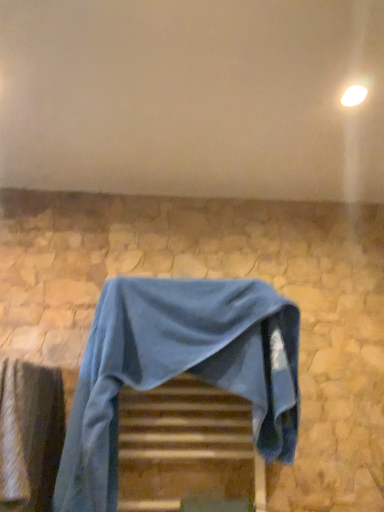
What is the approximate height of blue fabric at lower left?

It is 16.60 inches.

Looking at this image, in order to face wooden at center, should I rotate leftwards or rightwards?

Rotate your view left by about 0.312°.

Measure the distance between blue fabric-covered chair at center and camera.

They are 1.01 meters apart.

This screenshot has height=512, width=384. Find the location of `blue fabric at lower left`. blue fabric at lower left is located at coordinates (30, 435).

Is wooden at center positioned beyond the bounds of blue fabric-covered chair at center?

Yes, wooden at center is outside of blue fabric-covered chair at center.

From the image's perspective, is wooden at center above or below blue fabric-covered chair at center?

From the image's perspective, wooden at center appears below blue fabric-covered chair at center.

Considering the positions of points (232, 421) and (267, 339), is point (232, 421) farther from camera compared to point (267, 339)?

Yes, it is behind point (267, 339).

Which of these two, blue fabric at lower left or smooth stone wall at upper center, is smaller?

smooth stone wall at upper center is smaller.

Is blue fabric at lower left far from smooth stone wall at upper center?

No, there isn't a large distance between blue fabric at lower left and smooth stone wall at upper center.

Does blue fabric at lower left have a lesser height compared to smooth stone wall at upper center?

No.

From the image's perspective, would you say smooth stone wall at upper center is shown under blue fabric at lower left?

No, from the image's perspective, smooth stone wall at upper center is not below blue fabric at lower left.

Is smooth stone wall at upper center facing towards blue fabric at lower left?

No, smooth stone wall at upper center is not facing towards blue fabric at lower left.

How distant is smooth stone wall at upper center from blue fabric at lower left?

smooth stone wall at upper center is 33.18 inches from blue fabric at lower left.

Where is `curtain below the smooth stone wall at upper center (from a real-world perspective)`? Image resolution: width=384 pixels, height=512 pixels. curtain below the smooth stone wall at upper center (from a real-world perspective) is located at coordinates (30, 435).

How many degrees apart are the facing directions of wooden at center and blue fabric at lower left?

The facing directions of wooden at center and blue fabric at lower left are 90.7 degrees apart.

Is wooden at center taller than blue fabric at lower left?

No.

In the image, is wooden at center positioned in front of or behind blue fabric at lower left?

Clearly, wooden at center is behind blue fabric at lower left.

From a real-world perspective, between wooden at center and blue fabric at lower left, who is vertically higher?

From a 3D spatial view, blue fabric at lower left is above.

Is smooth stone wall at upper center looking in the opposite direction of blue fabric-covered chair at center?

smooth stone wall at upper center is not turned away from blue fabric-covered chair at center.

Would you say smooth stone wall at upper center is outside blue fabric-covered chair at center?

Yes, smooth stone wall at upper center is located beyond the bounds of blue fabric-covered chair at center.

From a real-world perspective, who is located lower, smooth stone wall at upper center or blue fabric-covered chair at center?

blue fabric-covered chair at center.

Which is closer to the camera, (360, 118) or (178, 337)?

Point (360, 118) is positioned farther from the camera compared to point (178, 337).

Is blue fabric at lower left in front of wooden at center?

Yes.

Is blue fabric at lower left facing away from wooden at center?

blue fabric at lower left is not turned away from wooden at center.

Can we say blue fabric at lower left lies outside wooden at center?

blue fabric at lower left is positioned outside wooden at center.

From the picture: Measure the distance from blue fabric-covered chair at center to smooth stone wall at upper center.

blue fabric-covered chair at center is 60.54 centimeters away from smooth stone wall at upper center.

Looking at this image, does blue fabric-covered chair at center have a smaller size compared to smooth stone wall at upper center?

Incorrect, blue fabric-covered chair at center is not smaller in size than smooth stone wall at upper center.

Is blue fabric-covered chair at center surrounding smooth stone wall at upper center?

No, smooth stone wall at upper center is not a part of blue fabric-covered chair at center.

Is blue fabric-covered chair at center taller than smooth stone wall at upper center?

Correct, blue fabric-covered chair at center is much taller as smooth stone wall at upper center.

The height and width of the screenshot is (512, 384). Identify the location of stairwell lying on the right of blue fabric-covered chair at center. (186, 447).

Where is `curtain located underneath the smooth stone wall at upper center (from a real-world perspective)`? The height and width of the screenshot is (512, 384). curtain located underneath the smooth stone wall at upper center (from a real-world perspective) is located at coordinates (30, 435).

When comparing their distances from wooden at center, does blue fabric at lower left or smooth stone wall at upper center seem further?

smooth stone wall at upper center is positioned further to the anchor wooden at center.

Based on their spatial positions, is smooth stone wall at upper center or wooden at center closer to blue fabric at lower left?

wooden at center is closer to blue fabric at lower left.

Considering their positions, is blue fabric-covered chair at center positioned further to wooden at center than blue fabric at lower left?

Among the two, blue fabric at lower left is located further to wooden at center.

Based on their spatial positions, is wooden at center or smooth stone wall at upper center closer to blue fabric-covered chair at center?

The object closer to blue fabric-covered chair at center is wooden at center.

Which object lies further to the anchor point smooth stone wall at upper center, wooden at center or blue fabric-covered chair at center?

wooden at center lies further to smooth stone wall at upper center than the other object.

From the image, which object appears to be nearer to wooden at center, blue fabric at lower left or blue fabric-covered chair at center?

blue fabric-covered chair at center is closer to wooden at center.

When comparing their distances from blue fabric at lower left, does blue fabric-covered chair at center or smooth stone wall at upper center seem further?

Among the two, smooth stone wall at upper center is located further to blue fabric at lower left.

Consider the image. Based on their spatial positions, is smooth stone wall at upper center or blue fabric-covered chair at center closer to blue fabric at lower left?

blue fabric-covered chair at center.

This screenshot has width=384, height=512. Identify the location of curtain between smooth stone wall at upper center and wooden at center vertically. (30, 435).

Where is `furniture between blue fabric at lower left and wooden at center from left to right`? This screenshot has height=512, width=384. furniture between blue fabric at lower left and wooden at center from left to right is located at coordinates [x=178, y=369].

In order to click on furniture between smooth stone wall at upper center and blue fabric at lower left from top to bottom in this screenshot , I will do `click(178, 369)`.

Find the location of a particular element. furniture between smooth stone wall at upper center and wooden at center in the up-down direction is located at coordinates (178, 369).